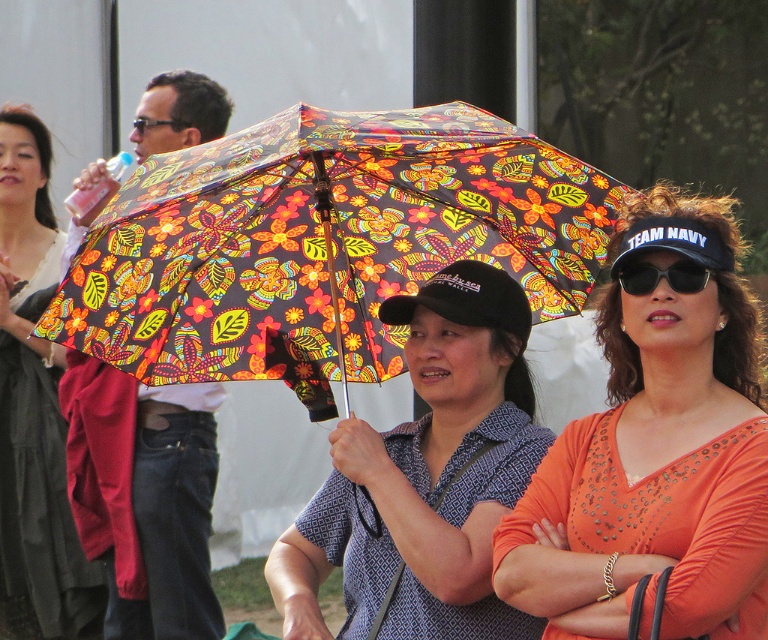
You are a photographer trying to capture a photo of the matte black umbrella at upper center and the black plastic sunglasses at upper right. Based on their positions, which object should you adjust your camera focus to first if you want to ensure both are in focus?

The matte black umbrella at upper center is to the left of the black plastic sunglasses at upper right. Since they are positioned side by side horizontally, adjusting focus on either object first should work as long as the camera has enough depth of field to cover both.